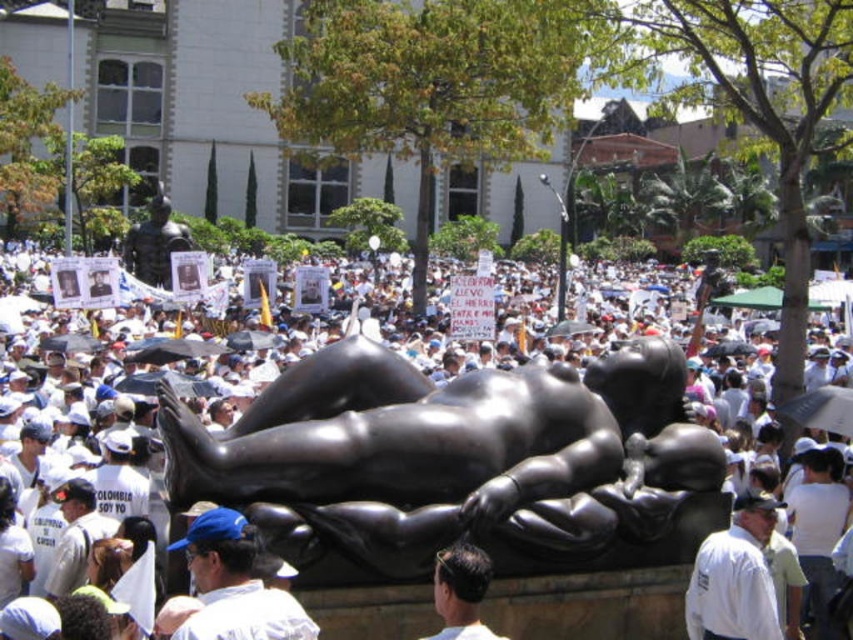
Question: Does black polished statue at center have a greater width compared to bronze statue at upper center?

Choices:
 (A) no
 (B) yes

Answer: (A)

Question: Which object is positioned closest to the bronze statue at upper center?

Choices:
 (A) white matte crowd at center
 (B) white matte shirt at center
 (C) blue fabric cap at center
 (D) black polished statue at center

Answer: (A)

Question: Which point is closer to the camera taking this photo?

Choices:
 (A) (279, 604)
 (B) (650, 518)
 (C) (155, 260)

Answer: (A)

Question: Does white matte crowd at center have a lesser width compared to blue fabric cap at center?

Choices:
 (A) yes
 (B) no

Answer: (B)

Question: Which of the following is the closest to the observer?

Choices:
 (A) (730, 620)
 (B) (212, 616)

Answer: (B)

Question: Can you confirm if white matte crowd at center is positioned to the left of dark brown hair at center?

Choices:
 (A) yes
 (B) no

Answer: (B)